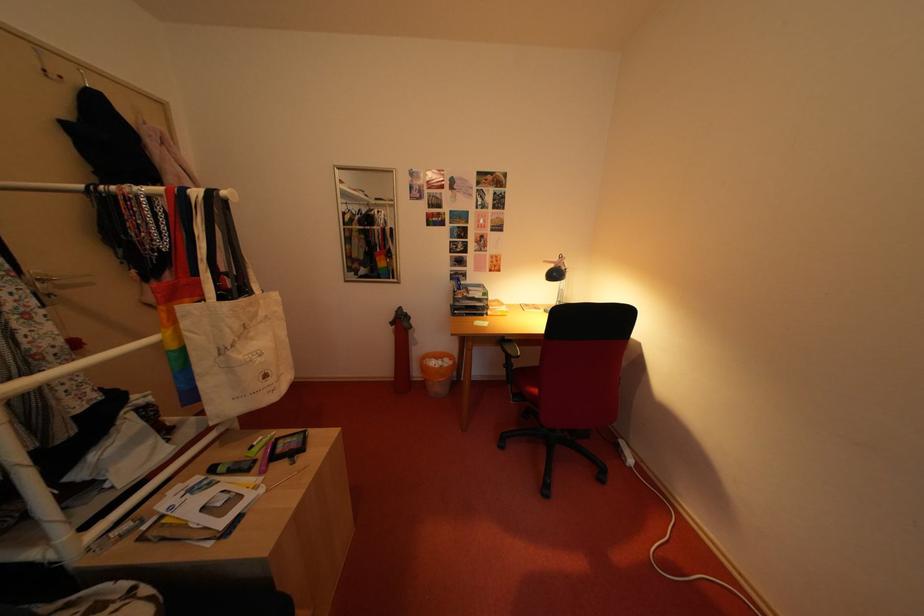
What are the coordinates of `desk lamp head` in the screenshot? It's located at click(x=556, y=272).